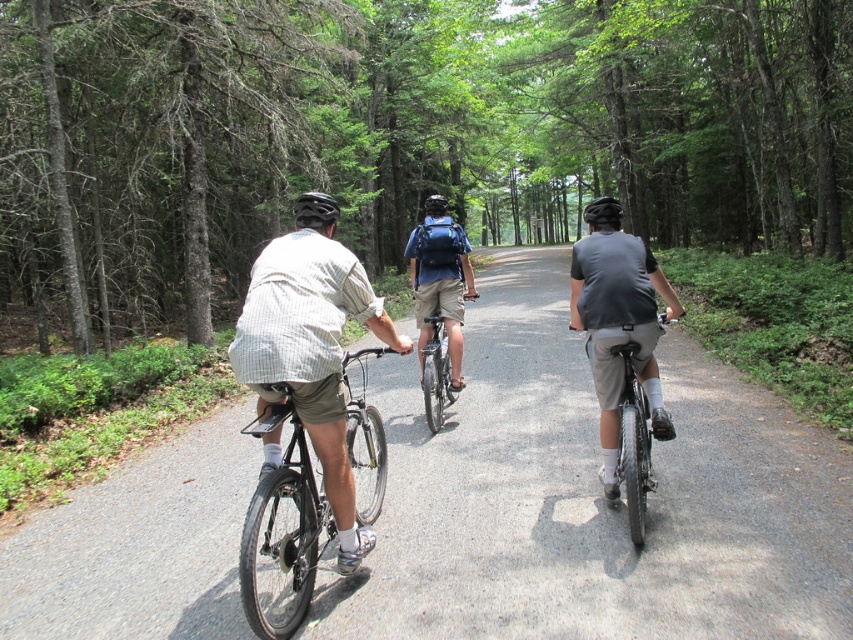
Between gray asphalt road at center and gray matte shirt at center, which one is positioned higher?

gray matte shirt at center

The image size is (853, 640). Describe the element at coordinates (590, 497) in the screenshot. I see `gray asphalt road at center` at that location.

Locate an element on the screen. gray asphalt road at center is located at coordinates (590, 497).

Does gray matte shirt at center have a lesser height compared to blue backpack at center?

In fact, gray matte shirt at center may be taller than blue backpack at center.

Does gray matte shirt at center have a smaller size compared to blue backpack at center?

Actually, gray matte shirt at center might be larger than blue backpack at center.

Find the location of a particular element. Image resolution: width=853 pixels, height=640 pixels. gray matte shirt at center is located at coordinates (619, 328).

The image size is (853, 640). What do you see at coordinates (440, 284) in the screenshot? I see `blue backpack at center` at bounding box center [440, 284].

Who is taller, blue backpack at center or black matte bicycle helmet at upper center?

Standing taller between the two is black matte bicycle helmet at upper center.

Which is in front, point (447, 339) or point (300, 216)?

Positioned in front is point (300, 216).

Locate an element on the screen. blue backpack at center is located at coordinates (440, 284).